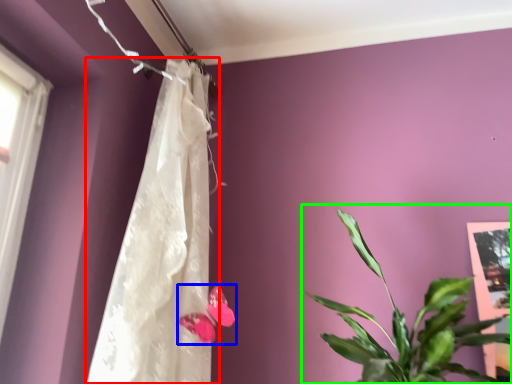
Question: Estimate the real-world distances between objects in this image. Which object is farther from curtain (highlighted by a red box), flower (highlighted by a blue box) or houseplant (highlighted by a green box)?

Choices:
 (A) flower
 (B) houseplant

Answer: (B)